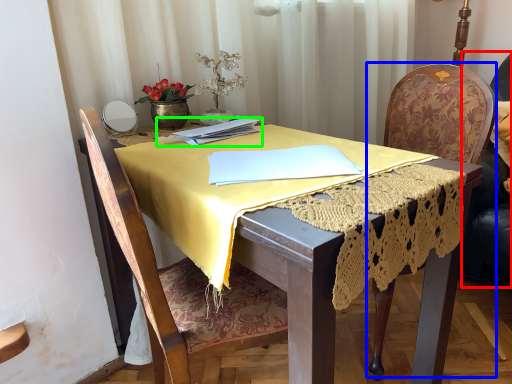
Question: Estimate the real-world distances between objects in this image. Which object is closer to swivel chair (highlighted by a red box), chair (highlighted by a blue box) or notebook (highlighted by a green box)?

Choices:
 (A) chair
 (B) notebook

Answer: (A)